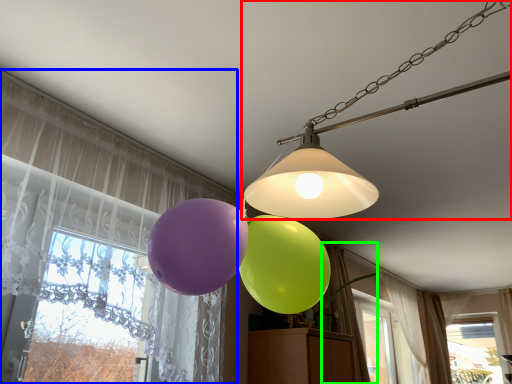
Question: Which object is positioned farthest from lamp (highlighted by a red box)? Select from curtain (highlighted by a blue box) and curtain (highlighted by a green box).

Choices:
 (A) curtain
 (B) curtain

Answer: (B)